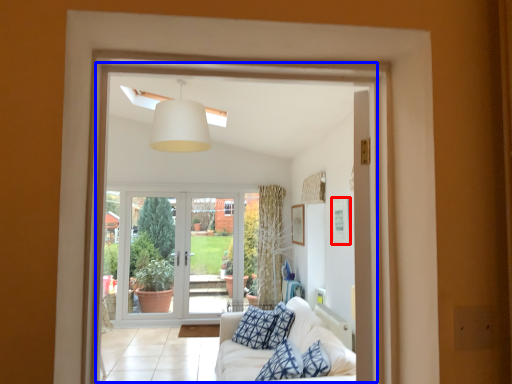
Question: Among these objects, which one is farthest to the camera, picture frame (highlighted by a red box) or window frame (highlighted by a blue box)?

Choices:
 (A) picture frame
 (B) window frame

Answer: (A)